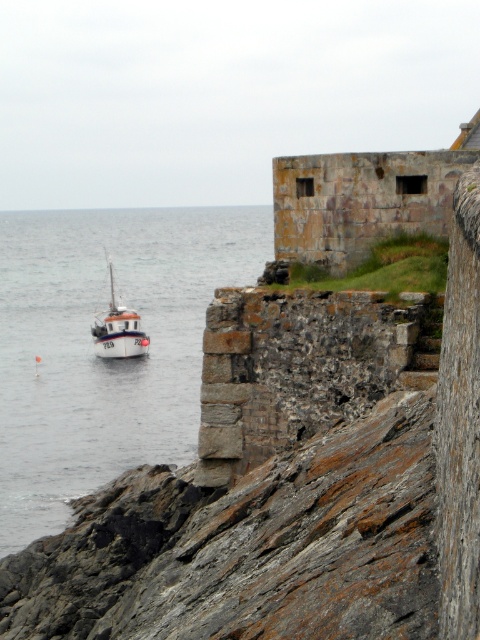
You are standing at the center of the stone wall and want to find the clear water at left. Which direction should you face to see it?

The clear water at left is located at point (93, 346), so you should face towards the left side of the wall to see it.

You are standing on the weathered stone wall and want to observe the clear water at left and the white matte boat at left. Which object is nearer to you?

The clear water at left is closer to the viewer than the white matte boat at left, so the clear water at left is nearer to you.

You are standing on the weathered stone wall and want to observe the clear water at left and the white matte boat at left. Which one appears higher from your vantage point?

The clear water at left appears higher than the white matte boat at left because it is taller.